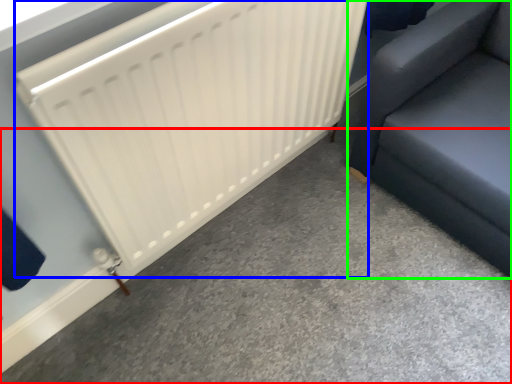
Question: Based on their relative distances, which object is farther from concrete (highlighted by a red box)? Choose from radiator (highlighted by a blue box) and furniture (highlighted by a green box).

Choices:
 (A) radiator
 (B) furniture

Answer: (A)